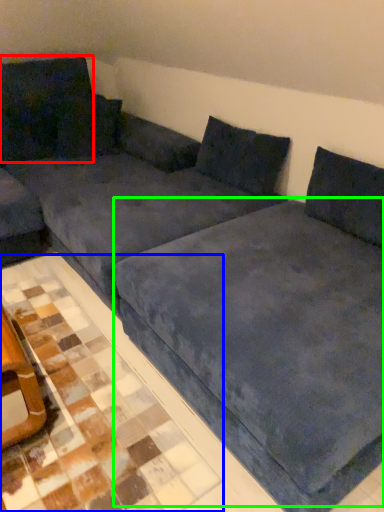
Question: Which object is the closest to the pillow (highlighted by a red box)? Choose among these: tile (highlighted by a blue box) or bedding (highlighted by a green box).

Choices:
 (A) tile
 (B) bedding

Answer: (A)